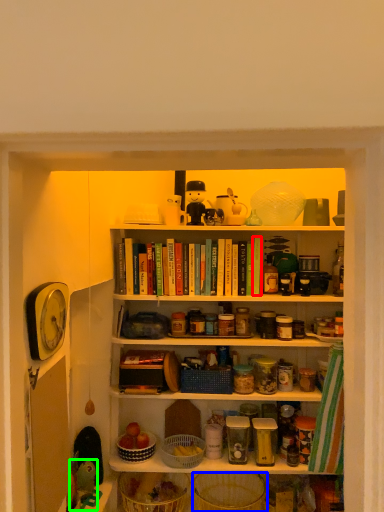
Question: Considering the real-world distances, which object is farthest from book (highlighted by a red box)? basket (highlighted by a blue box) or toy (highlighted by a green box)?

Choices:
 (A) basket
 (B) toy

Answer: (A)